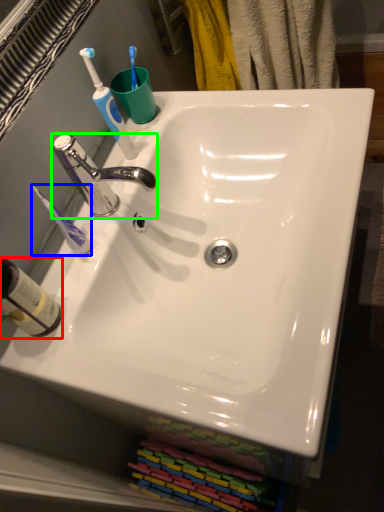
Question: Estimate the real-world distances between objects in this image. Which object is farther from bottle (highlighted by a red box), toothbrush (highlighted by a blue box) or tap (highlighted by a green box)?

Choices:
 (A) toothbrush
 (B) tap

Answer: (B)